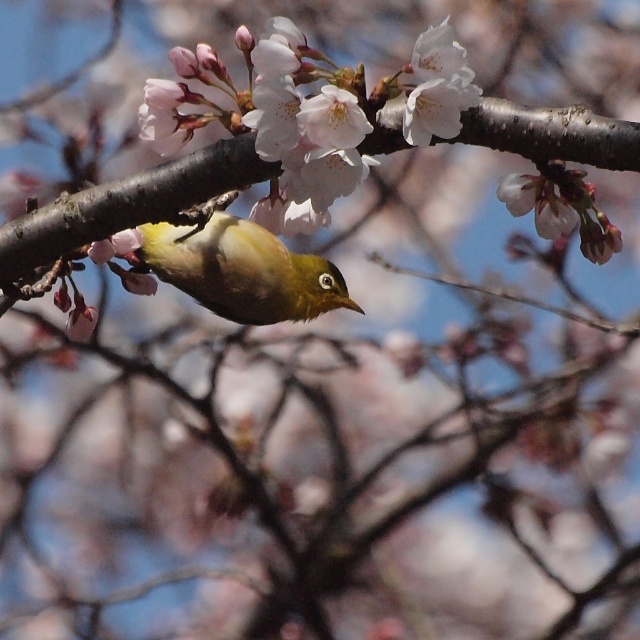
Which is in front, point (317, 300) or point (317, 141)?

Positioned in front is point (317, 141).

Between green matte bird at center and smooth white petal at center, which one appears on the left side from the viewer's perspective?

green matte bird at center

The width and height of the screenshot is (640, 640). Find the location of `green matte bird at center`. green matte bird at center is located at coordinates (240, 269).

You are a GUI agent. You are given a task and a screenshot of the screen. Output one action in this format:
    pyautogui.click(x=<x>, y=<y>)
    Task: Click on the green matte bird at center
    The height and width of the screenshot is (640, 640).
    Given the screenshot: What is the action you would take?
    pyautogui.click(x=240, y=269)